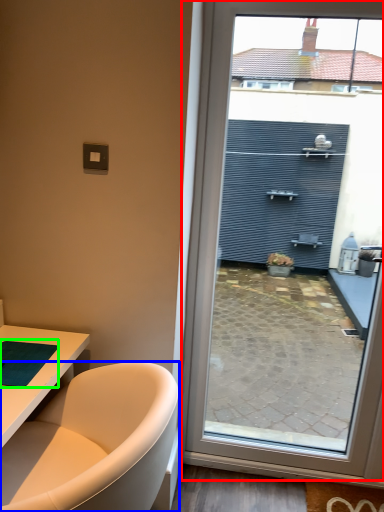
Question: Which is farther away from window (highlighted by a red box)? bathtub (highlighted by a blue box) or yoga mat (highlighted by a green box)?

Choices:
 (A) bathtub
 (B) yoga mat

Answer: (B)